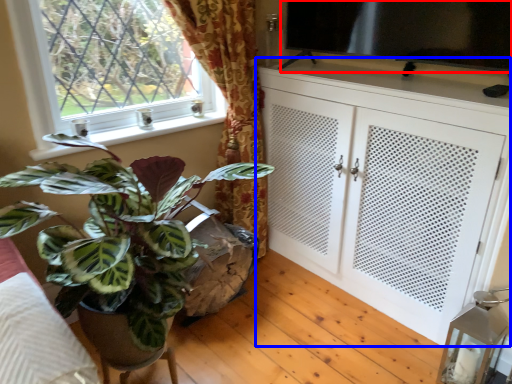
Question: Which object is closer to the camera taking this photo, window screen (highlighted by a red box) or cabinetry (highlighted by a blue box)?

Choices:
 (A) window screen
 (B) cabinetry

Answer: (B)